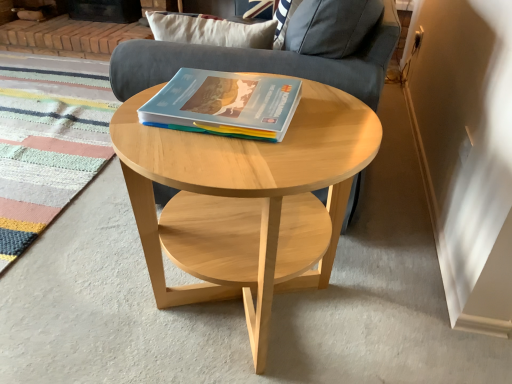
This screenshot has width=512, height=384. In order to click on free spot below natural wood coffee table at center (from a real-world perspective) in this screenshot , I will do `click(246, 332)`.